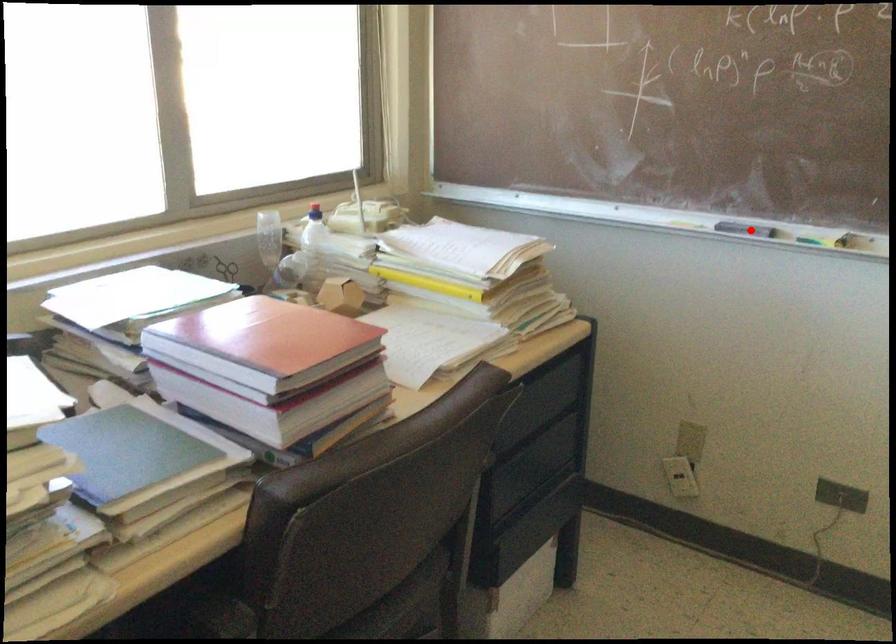
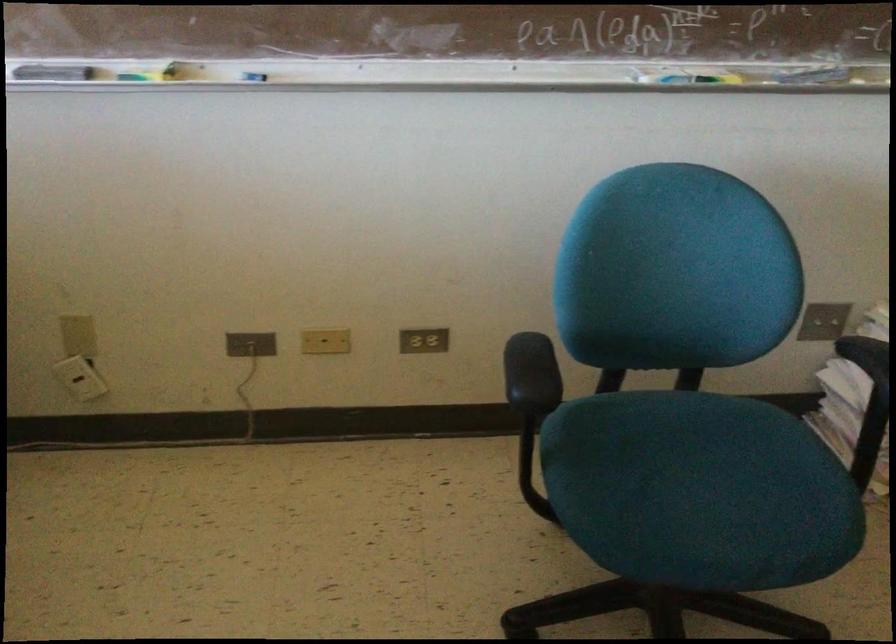
The point at the highlighted location is marked in the first image. Where is the corresponding point in the second image?

(53, 73)